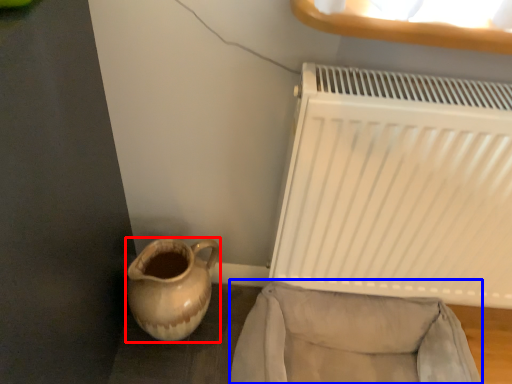
Question: Which object is further to the camera taking this photo, jug (highlighted by a red box) or armchair (highlighted by a blue box)?

Choices:
 (A) jug
 (B) armchair

Answer: (A)